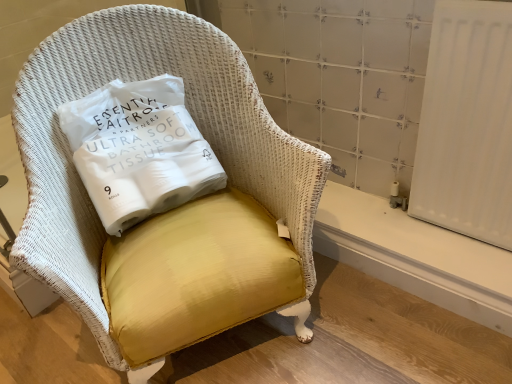
This screenshot has height=384, width=512. Identify the location of free point above white smooth radiator at lower right (from a real-world perspective). [404, 225].